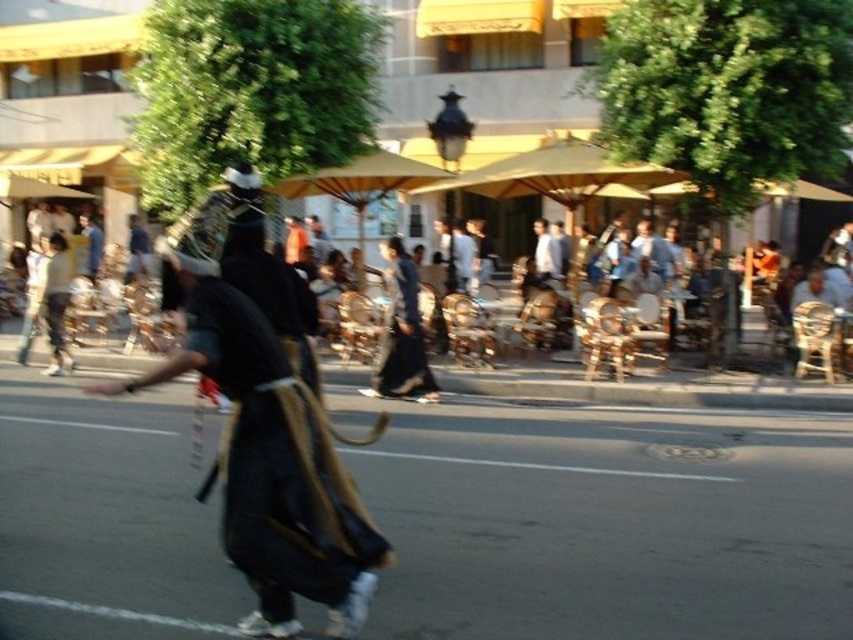
Who is positioned more to the left, black fabric mask at center or dark blue fabric dress at center?

black fabric mask at center

Between black fabric mask at center and dark blue fabric dress at center, which one has less height?

Standing shorter between the two is black fabric mask at center.

Describe the element at coordinates (271, 467) in the screenshot. I see `black fabric mask at center` at that location.

The height and width of the screenshot is (640, 853). What are the coordinates of `black fabric mask at center` in the screenshot? It's located at (271, 467).

Can you confirm if black fabric mask at center is thinner than light blue fabric shirt at center?

In fact, black fabric mask at center might be wider than light blue fabric shirt at center.

Which is in front, point (234, 428) or point (640, 232)?

Point (234, 428)

I want to click on black fabric mask at center, so click(271, 467).

Which of these two, light blue fabric shirt at center or dark blue fabric at center, stands taller?

dark blue fabric at center is taller.

Does light blue fabric shirt at center appear over dark blue fabric at center?

Incorrect, light blue fabric shirt at center is not positioned above dark blue fabric at center.

Between point (671, 266) and point (546, 248), which one is positioned in front?

Positioned in front is point (671, 266).

Where is `light blue fabric shirt at center`? light blue fabric shirt at center is located at coordinates (653, 250).